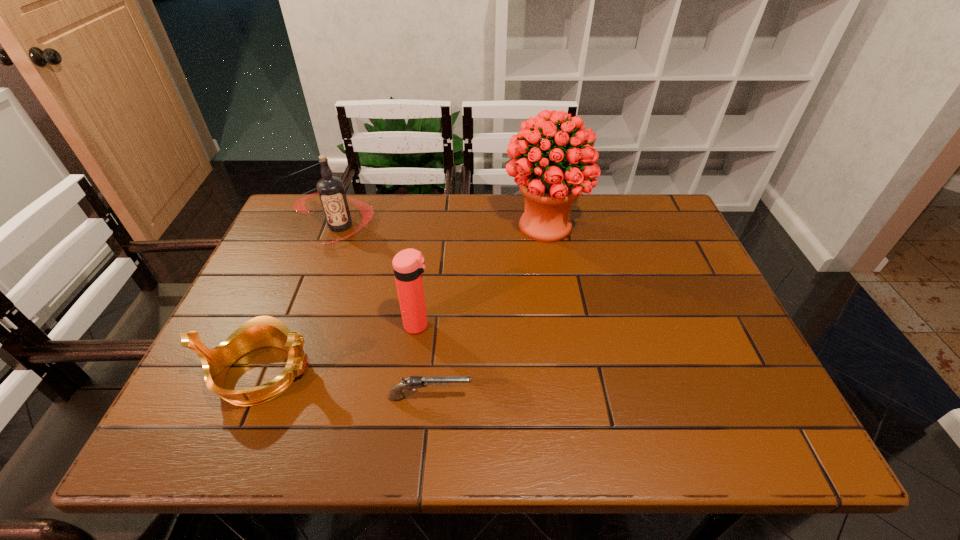
This screenshot has height=540, width=960. Identify the location of vacant space located 0.100m aiming along the barrel of the gun. (521, 397).

Where is `bouquet that is positioned at the far edge`? This screenshot has height=540, width=960. bouquet that is positioned at the far edge is located at coordinates (549, 188).

The width and height of the screenshot is (960, 540). I want to click on root beer that is positioned at the far edge, so click(x=331, y=191).

Where is `object that is at the near edge`? The width and height of the screenshot is (960, 540). object that is at the near edge is located at coordinates (263, 331).

I want to click on root beer located at the left edge, so click(331, 191).

This screenshot has width=960, height=540. In order to click on tiara located at the left edge in this screenshot , I will do `click(263, 331)`.

You are a GUI agent. You are given a task and a screenshot of the screen. Output one action in this format:
    pyautogui.click(x=<x>, y=<y>)
    Task: Click on the object present at the far left corner
    
    Given the screenshot: What is the action you would take?
    pyautogui.click(x=331, y=191)

Find the location of a particular element. object that is positioned at the near left corner is located at coordinates (263, 331).

The width and height of the screenshot is (960, 540). I want to click on vacant space at the far edge of the desktop, so click(x=497, y=213).

I want to click on free space at the near edge of the desktop, so click(x=497, y=447).